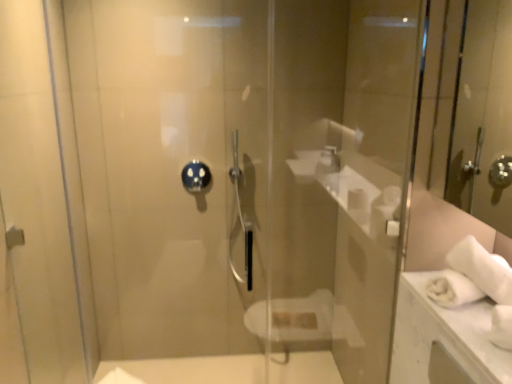
Question: Is blue glossy showerhead at center closer to camera compared to transparent glass screen door at left?

Choices:
 (A) yes
 (B) no

Answer: (B)

Question: Considering the relative sizes of blue glossy showerhead at center and transparent glass screen door at left in the image provided, is blue glossy showerhead at center taller than transparent glass screen door at left?

Choices:
 (A) yes
 (B) no

Answer: (B)

Question: Is blue glossy showerhead at center far from transparent glass screen door at left?

Choices:
 (A) yes
 (B) no

Answer: (B)

Question: Is blue glossy showerhead at center shorter than transparent glass screen door at left?

Choices:
 (A) no
 (B) yes

Answer: (B)

Question: Can you confirm if blue glossy showerhead at center is wider than transparent glass screen door at left?

Choices:
 (A) no
 (B) yes

Answer: (A)

Question: Could you tell me if blue glossy showerhead at center is facing transparent glass screen door at left?

Choices:
 (A) yes
 (B) no

Answer: (B)

Question: Is transparent glass door at center outside of blue glossy showerhead at center?

Choices:
 (A) yes
 (B) no

Answer: (A)

Question: Is transparent glass door at center oriented towards blue glossy showerhead at center?

Choices:
 (A) yes
 (B) no

Answer: (B)

Question: Does transparent glass door at center lie behind blue glossy showerhead at center?

Choices:
 (A) yes
 (B) no

Answer: (B)

Question: Is transparent glass door at center positioned with its back to blue glossy showerhead at center?

Choices:
 (A) no
 (B) yes

Answer: (A)

Question: Is transparent glass door at center positioned in front of blue glossy showerhead at center?

Choices:
 (A) no
 (B) yes

Answer: (B)

Question: Does transparent glass door at center appear on the left side of blue glossy showerhead at center?

Choices:
 (A) yes
 (B) no

Answer: (B)

Question: Is the surface of blue glossy showerhead at center in direct contact with transparent glass door at center?

Choices:
 (A) yes
 (B) no

Answer: (B)